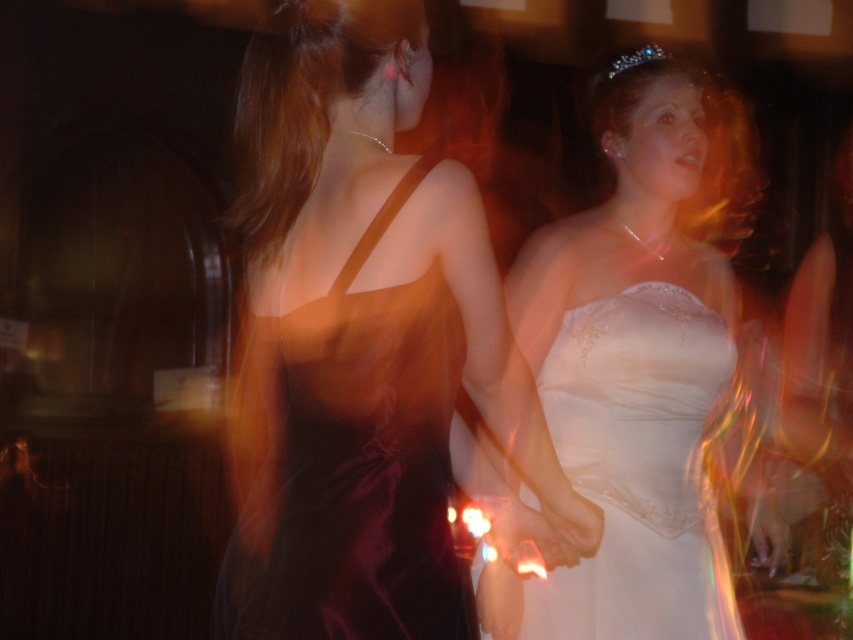
Question: Which point appears farthest from the camera in this image?

Choices:
 (A) (647, 442)
 (B) (471, 292)
 (C) (628, 65)

Answer: (C)

Question: Estimate the real-world distances between objects in this image. Which object is closer to the satin burgundy dress at center?

Choices:
 (A) clear crystal tiara at upper right
 (B) white satin dress at center

Answer: (B)

Question: Which point is farther to the camera?

Choices:
 (A) satin burgundy dress at center
 (B) clear crystal tiara at upper right

Answer: (B)

Question: Is satin burgundy dress at center below white satin dress at center?

Choices:
 (A) yes
 (B) no

Answer: (B)

Question: Does satin burgundy dress at center appear under clear crystal tiara at upper right?

Choices:
 (A) no
 (B) yes

Answer: (B)

Question: Does satin burgundy dress at center appear on the left side of clear crystal tiara at upper right?

Choices:
 (A) yes
 (B) no

Answer: (A)